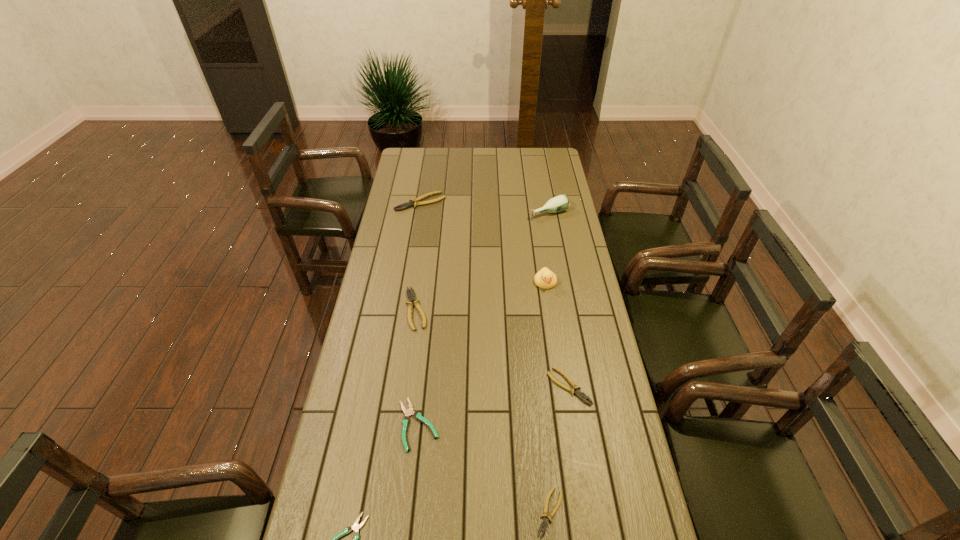
Where is `pliers that is at the right edge`? pliers that is at the right edge is located at coordinates (578, 392).

Find the location of `free space at the left edge of the desktop`. free space at the left edge of the desktop is located at coordinates (373, 442).

Locate an element on the screen. vacant point at the right edge is located at coordinates (558, 298).

Identify the location of free region at the far left corner. This screenshot has width=960, height=540. (426, 170).

The width and height of the screenshot is (960, 540). In order to click on empty location between the bottle and the right teal pliers in this screenshot , I will do `click(483, 319)`.

Locate an element on the screen. The height and width of the screenshot is (540, 960). unoccupied position between the second biggest yellow pliers and the biggest yellow pliers is located at coordinates (419, 255).

Where is `empty location between the farthest yellow pliers and the second farthest yellow pliers`? The image size is (960, 540). empty location between the farthest yellow pliers and the second farthest yellow pliers is located at coordinates (419, 255).

What are the coordinates of `vacant area that lies between the farthest yellow pliers and the duckling` in the screenshot? It's located at (483, 242).

Image resolution: width=960 pixels, height=540 pixels. Find the location of `free point between the farthest pliers and the yellow duckling`. free point between the farthest pliers and the yellow duckling is located at coordinates (483, 242).

What are the coordinates of `vacant area that lies between the fourth shortest object and the bottle` in the screenshot? It's located at (559, 300).